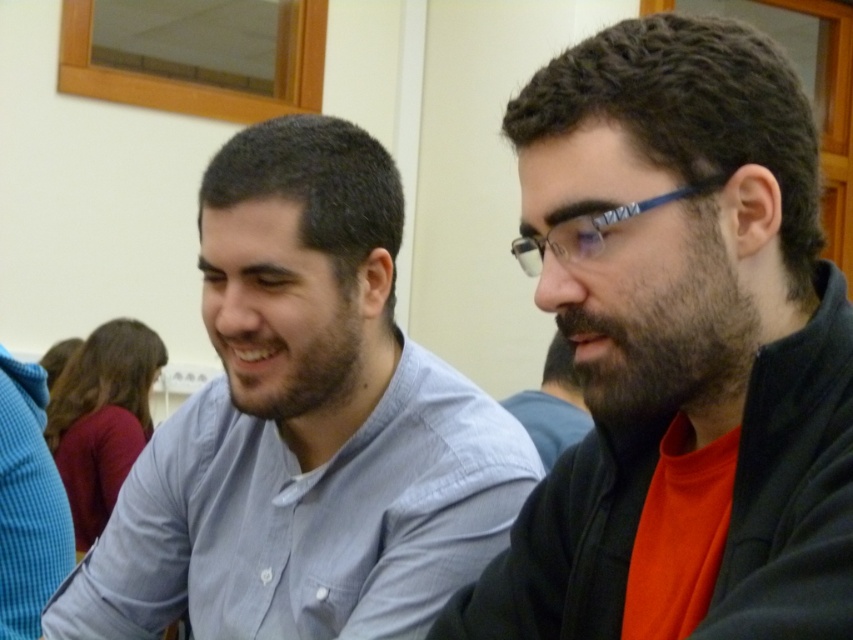
Question: Estimate the real-world distances between objects in this image. Which object is closer to the matte black jacket at right?

Choices:
 (A) beard at center
 (B) light blue shirt at center

Answer: (B)

Question: Can you confirm if matte black jacket at right is positioned to the right of beard at center?

Choices:
 (A) yes
 (B) no

Answer: (B)

Question: Estimate the real-world distances between objects in this image. Which object is farther from the matte black jacket at right?

Choices:
 (A) light blue shirt at center
 (B) beard at center

Answer: (B)

Question: Which is nearer to the beard at center?

Choices:
 (A) light blue shirt at center
 (B) matte black jacket at right

Answer: (A)

Question: Can you confirm if matte black jacket at right is bigger than beard at center?

Choices:
 (A) no
 (B) yes

Answer: (B)

Question: Can you confirm if light blue shirt at center is positioned above beard at center?

Choices:
 (A) no
 (B) yes

Answer: (A)